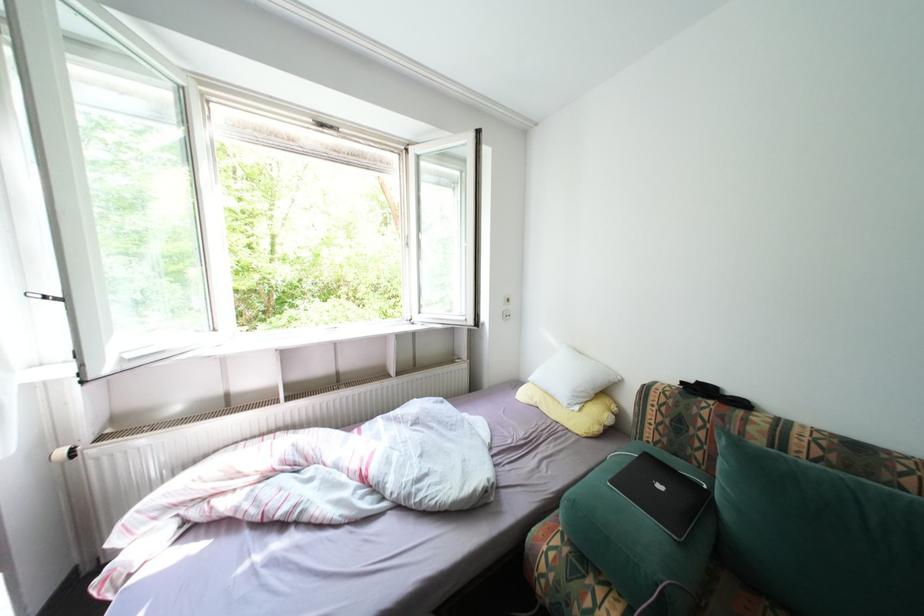
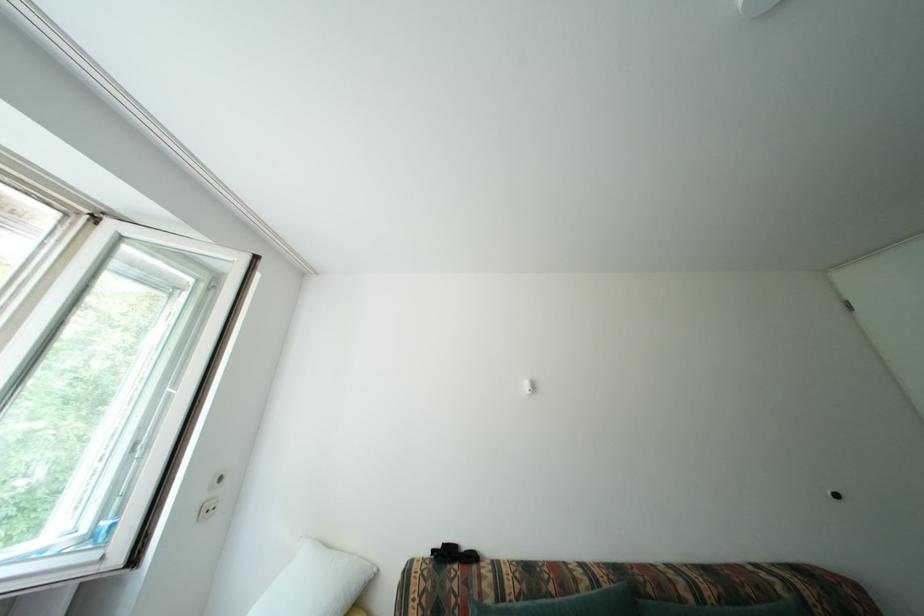
The first image is from the beginning of the video and the second image is from the end. How did the camera likely rotate when shooting the video?

The rotation direction of the camera is right-up.